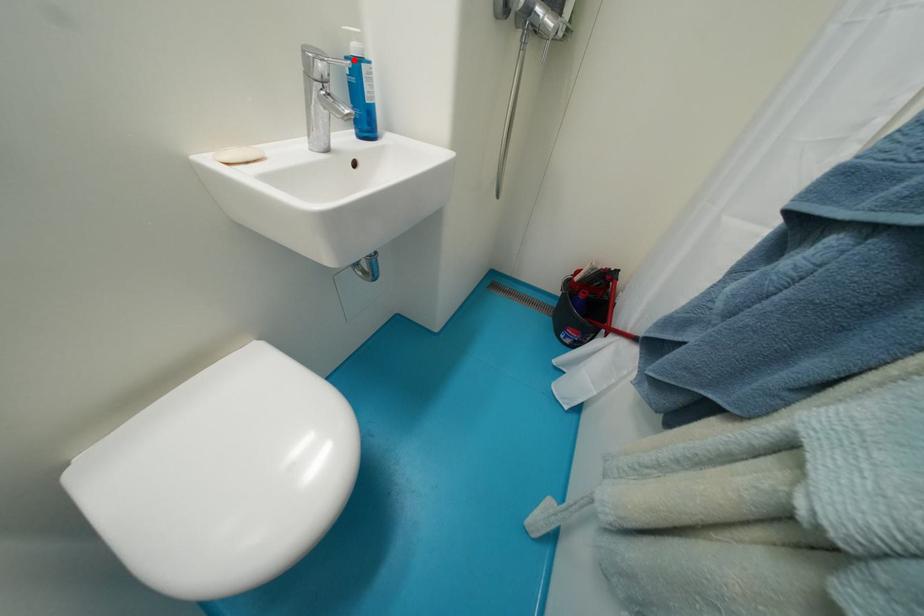
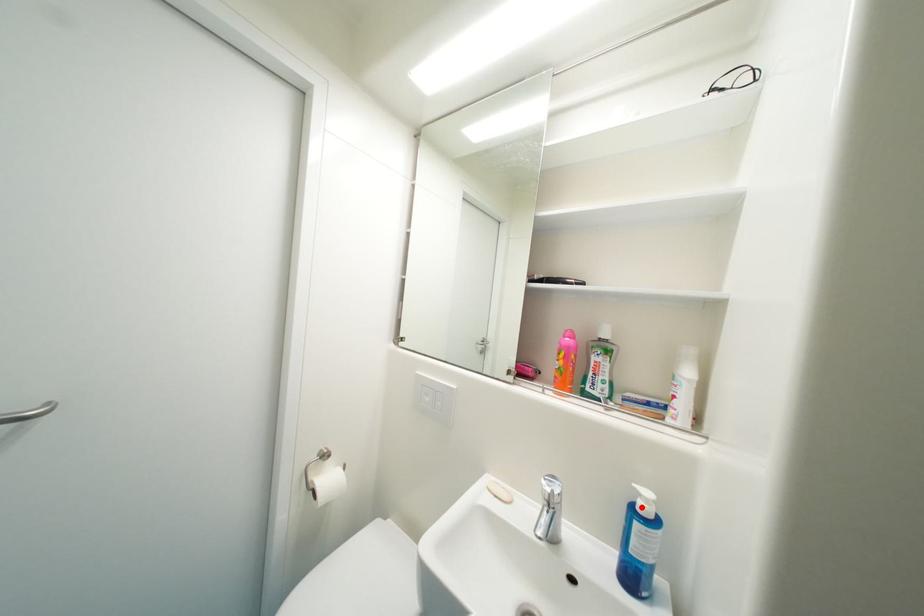
I am providing you with two images of the same scene from different viewpoints. A red point is marked on the first image and another point is marked on the second image. Is the marked point in image1 the same physical position as the marked point in image2?

Yes